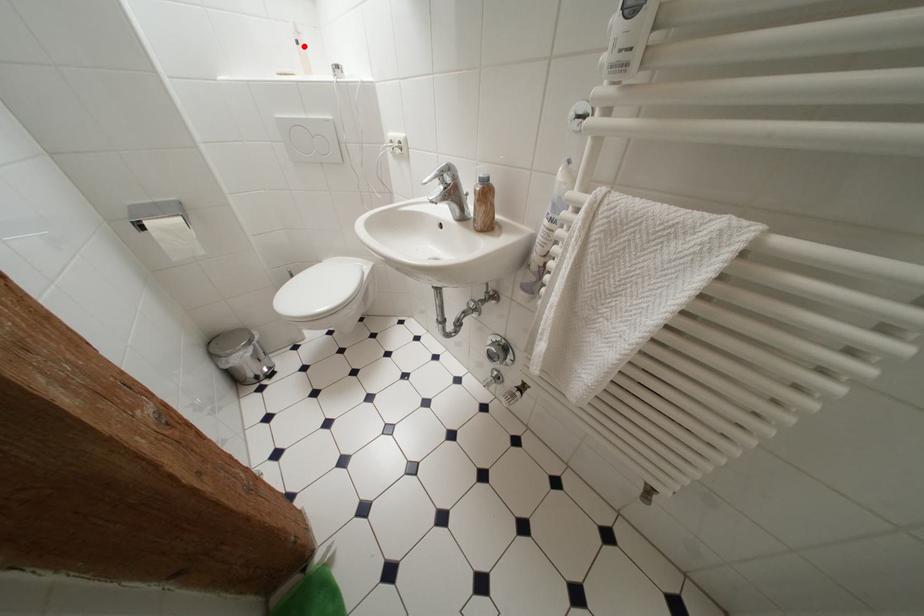
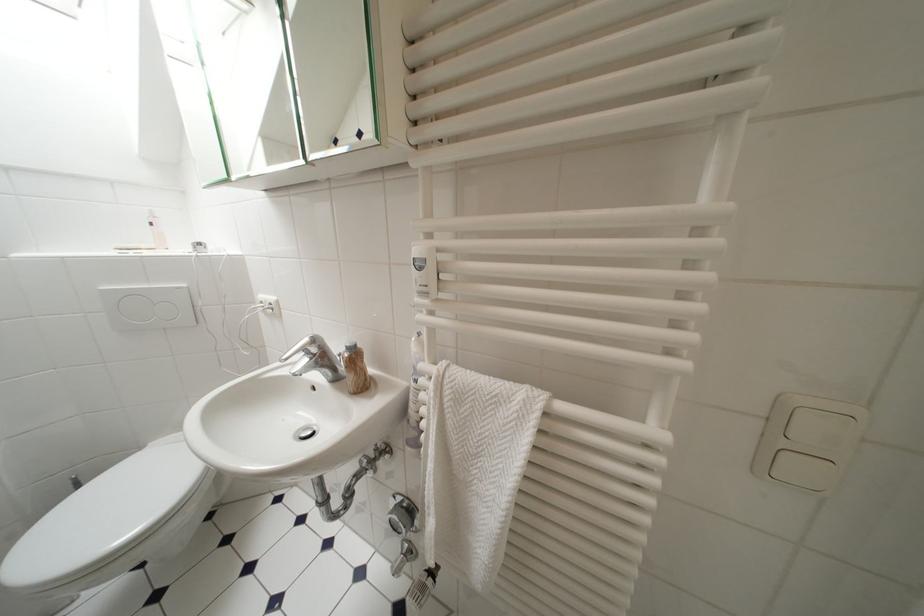
Find the pixel in the second image that matches the highlighted location in the first image.

(159, 227)